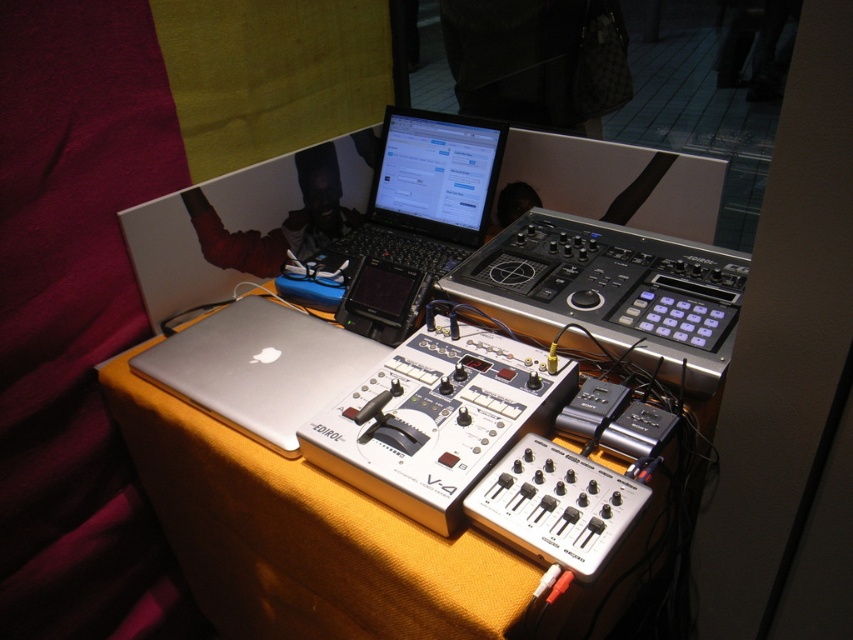
Between silver metallic mixer at center and sleek black laptop at center, which one is positioned lower?

silver metallic mixer at center

Is silver metallic mixer at center further to camera compared to sleek black laptop at center?

No, silver metallic mixer at center is in front of sleek black laptop at center.

Does point (465, 451) come closer to viewer compared to point (418, 154)?

Yes, point (465, 451) is in front of point (418, 154).

At what (x,y) coordinates should I click in order to perform the action: click on silver metallic mixer at center. Please return your answer as a coordinate pair (x, y). Image resolution: width=853 pixels, height=640 pixels. Looking at the image, I should click on (437, 419).

Between black plastic mixer at center and silver metallic mixer at center, which one has less height?

Standing shorter between the two is silver metallic mixer at center.

Does black plastic mixer at center appear on the right side of silver metallic mixer at center?

Indeed, black plastic mixer at center is positioned on the right side of silver metallic mixer at center.

At what (x,y) coordinates should I click in order to perform the action: click on black plastic mixer at center. Please return your answer as a coordinate pair (x, y). This screenshot has width=853, height=640. Looking at the image, I should click on pos(610,292).

The image size is (853, 640). In order to click on black plastic mixer at center in this screenshot , I will do `click(610, 292)`.

Does silver metallic mixer at center appear over silver metallic laptop at center?

No.

Where is `silver metallic mixer at center`? silver metallic mixer at center is located at coordinates (437, 419).